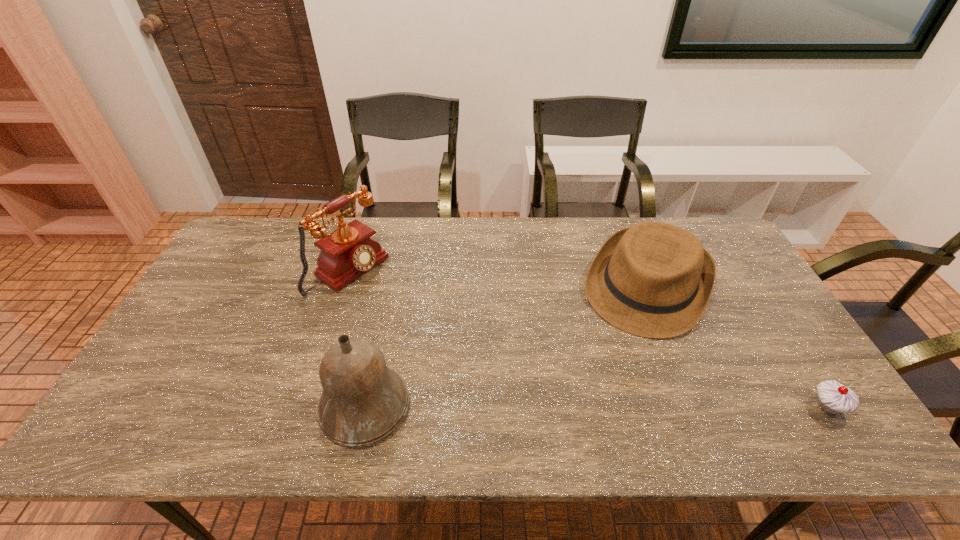
This screenshot has width=960, height=540. Find the location of `vacant space that satisfies the following two spatial constraints: 1. on the front side of the bell; 2. on the right side of the telephone`. vacant space that satisfies the following two spatial constraints: 1. on the front side of the bell; 2. on the right side of the telephone is located at coordinates (305, 407).

Find the location of a particular element. vacant space that satisfies the following two spatial constraints: 1. on the front side of the rightmost object; 2. on the left side of the second object from right to left is located at coordinates (694, 407).